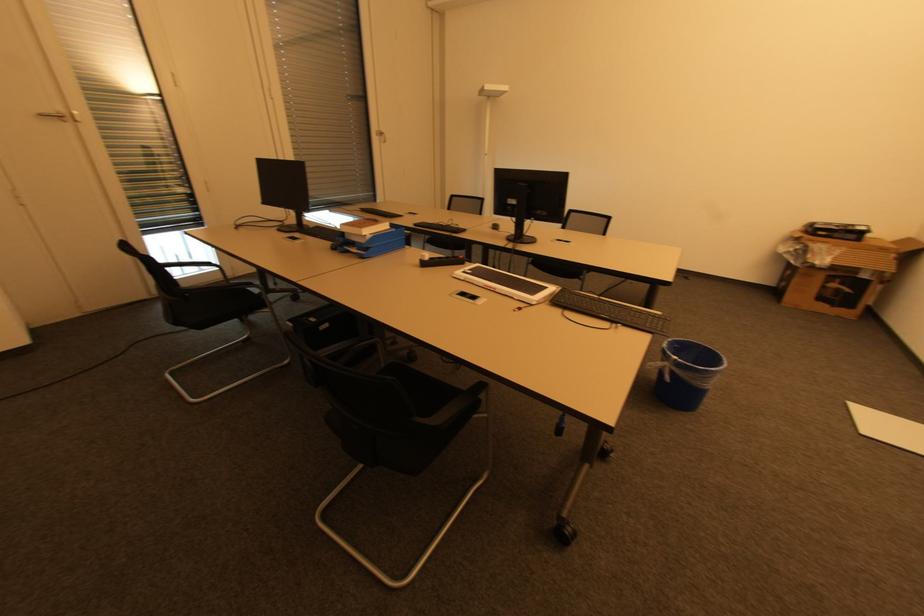
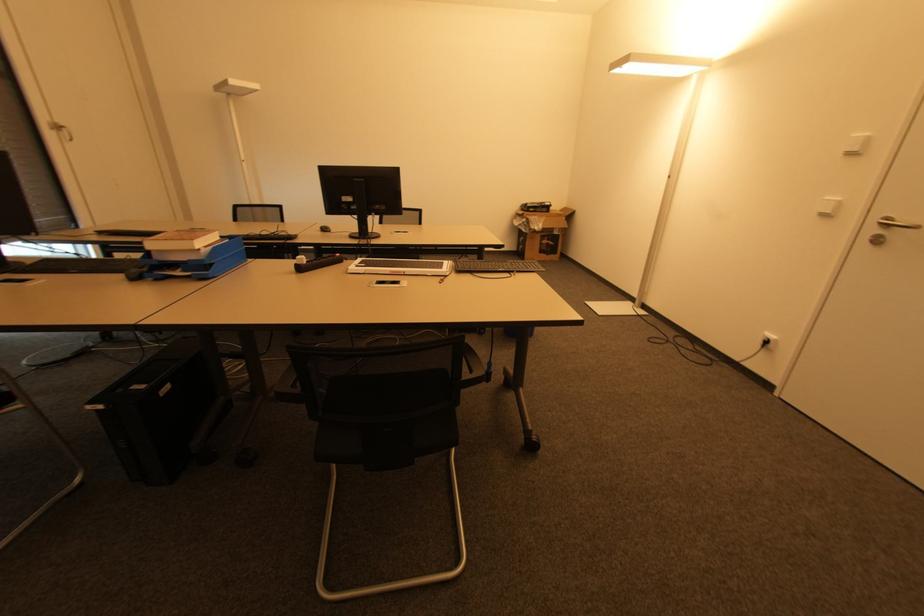
Locate, in the second image, the point that corresponds to the point at 466,273 in the first image.

(359, 267)